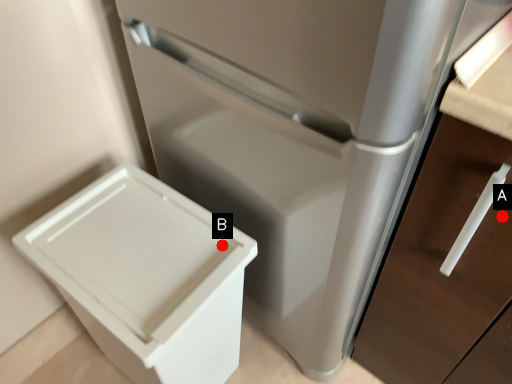
Question: Two points are circled on the image, labeled by A and B beside each circle. Which point is closer to the camera?

Choices:
 (A) A is closer
 (B) B is closer

Answer: (A)